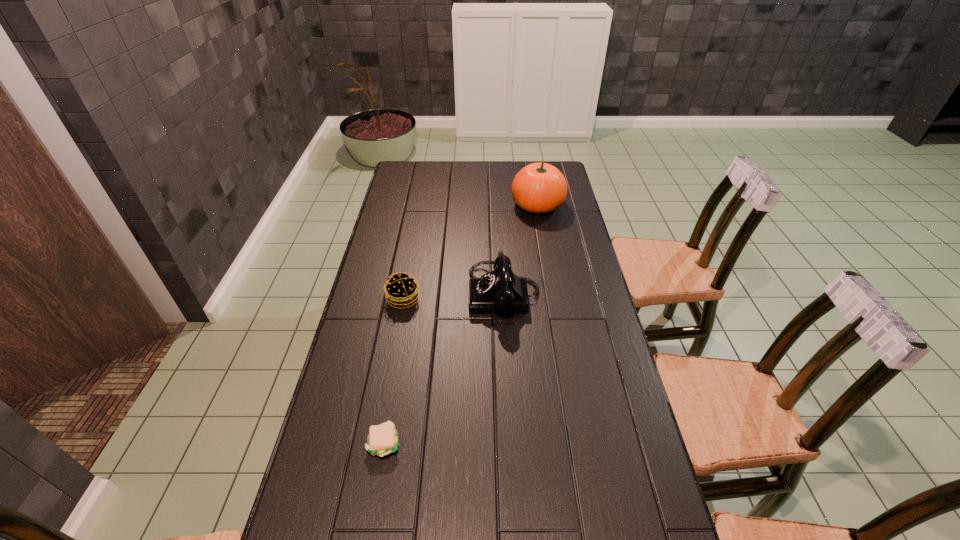
You are a GUI agent. You are given a task and a screenshot of the screen. Output one action in this format:
    pyautogui.click(x=<x>, y=<y>)
    Task: Click on the blank area in the image that satisfies the following two spatial constraints: 1. on the front side of the second shortest object; 2. on the left side of the nearest object
    The height and width of the screenshot is (540, 960).
    Given the screenshot: What is the action you would take?
    pyautogui.click(x=376, y=443)

Identify the location of free location that satisfies the following two spatial constraints: 1. on the back side of the taller patty; 2. on the right side of the farthest object. (420, 205).

Where is `free point that satisfies the following two spatial constraints: 1. on the front side of the third tallest object; 2. on the right side of the nearest object`? The image size is (960, 540). free point that satisfies the following two spatial constraints: 1. on the front side of the third tallest object; 2. on the right side of the nearest object is located at coordinates (376, 443).